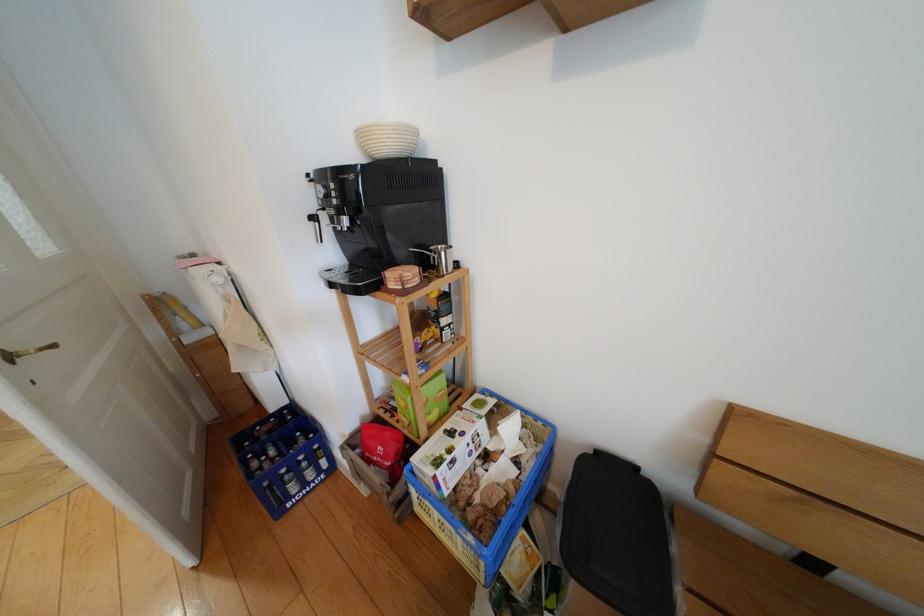
I want to click on green cardboard box, so click(x=420, y=400).